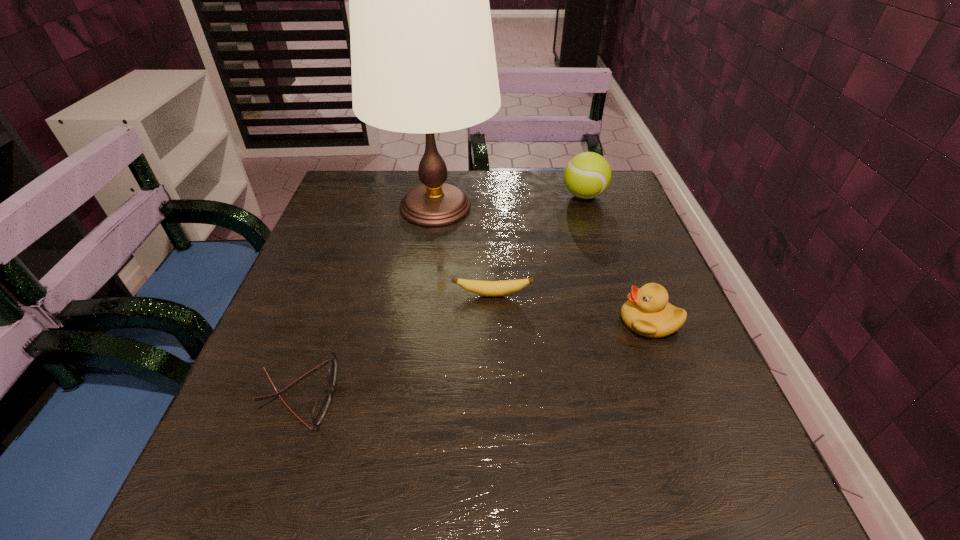
Locate an element on the screen. The height and width of the screenshot is (540, 960). lamp is located at coordinates (423, 60).

The height and width of the screenshot is (540, 960). In order to click on the second tallest object in this screenshot , I will do `click(587, 175)`.

The height and width of the screenshot is (540, 960). I want to click on the third shortest object, so click(x=647, y=312).

Identify the location of the second nearest object. The width and height of the screenshot is (960, 540). (647, 312).

Where is `the third farthest object`? the third farthest object is located at coordinates 485,288.

Locate an element on the screen. This screenshot has height=540, width=960. the nearest object is located at coordinates (320, 408).

I want to click on free space located on the front of the lamp, so click(x=421, y=314).

You are a GUI agent. You are given a task and a screenshot of the screen. Output one action in this format:
    pyautogui.click(x=<x>, y=<y>)
    Task: Click on the free space located 0.240m on the front of the second tallest object
    This screenshot has width=960, height=540.
    Given the screenshot: What is the action you would take?
    pyautogui.click(x=608, y=269)

At what (x,y) coordinates should I click in order to perform the action: click on vacant space located on the front-facing side of the second nearest object. Please return your answer as a coordinate pair (x, y). The height and width of the screenshot is (540, 960). Looking at the image, I should click on (453, 321).

The height and width of the screenshot is (540, 960). I want to click on vacant space located 0.290m on the front-facing side of the second nearest object, so click(468, 321).